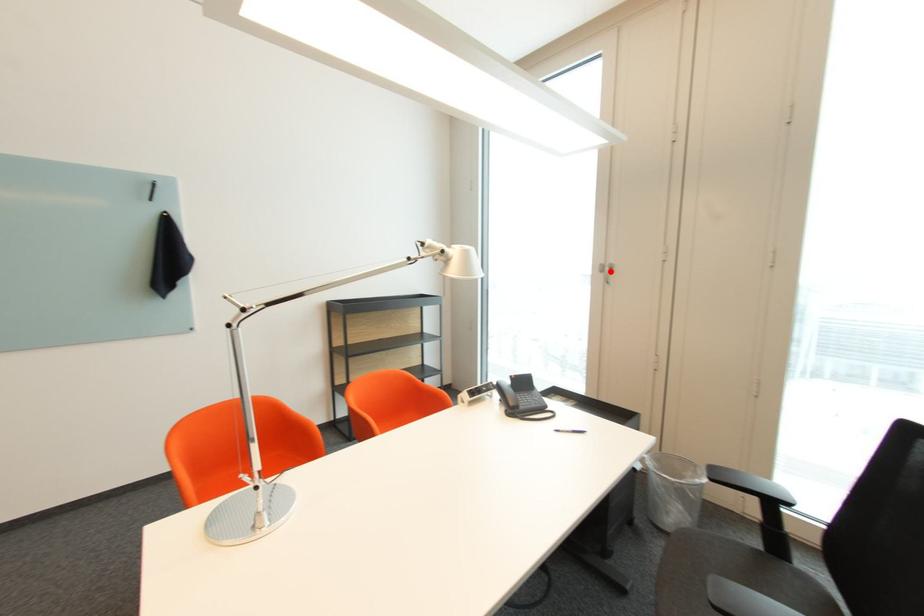
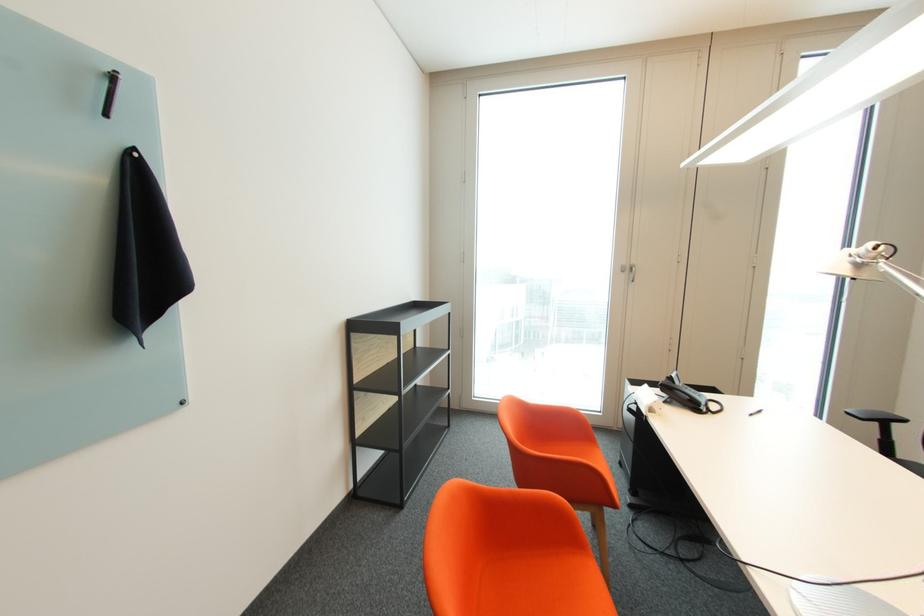
The point at the highlighted location is marked in the first image. Where is the corresponding point in the second image?

(629, 272)